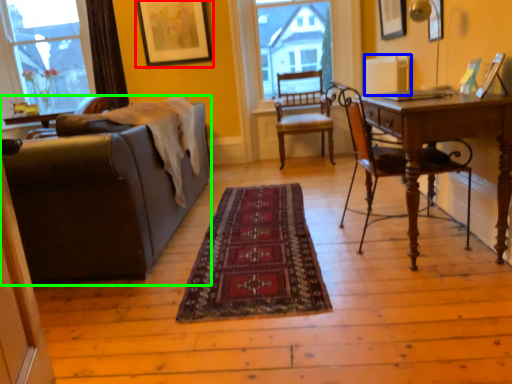
Question: Considering the real-world distances, which object is farthest from picture frame (highlighted by a red box)? radiator (highlighted by a blue box) or studio couch (highlighted by a green box)?

Choices:
 (A) radiator
 (B) studio couch

Answer: (B)